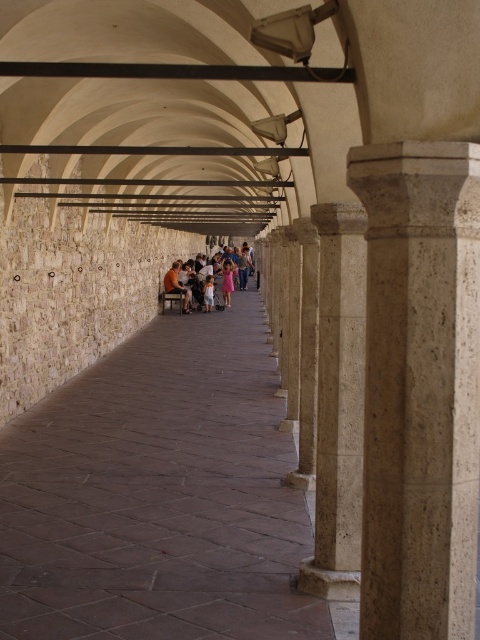
Question: Where is beige marble pillar at center located in relation to beige stone column at center in the image?

Choices:
 (A) above
 (B) below

Answer: (A)

Question: Among these objects, which one is nearest to the camera?

Choices:
 (A) beige marble pillar at center
 (B) brown leather jacket at center
 (C) beige stone column at center
 (D) pink fabric dress at center

Answer: (A)

Question: Which point appears closest to the camera in this image?

Choices:
 (A) (0, 461)
 (B) (343, 468)
 (C) (240, 253)

Answer: (B)

Question: Which is nearer to the beige marble pillar at center?

Choices:
 (A) brown stone path at center
 (B) brown leather jacket at center

Answer: (A)

Question: Is brown stone path at center smaller than brown leather jacket at center?

Choices:
 (A) yes
 (B) no

Answer: (B)

Question: Considering the relative positions of brown stone path at center and beige marble pillar at center in the image provided, where is brown stone path at center located with respect to beige marble pillar at center?

Choices:
 (A) left
 (B) right

Answer: (A)